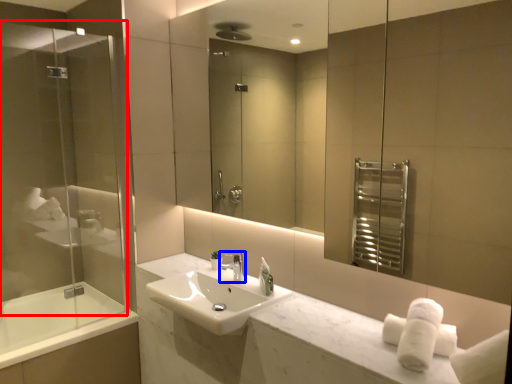
Question: Which object appears closest to the camera in this image, screen door (highlighted by a red box) or tap (highlighted by a blue box)?

Choices:
 (A) screen door
 (B) tap

Answer: (A)